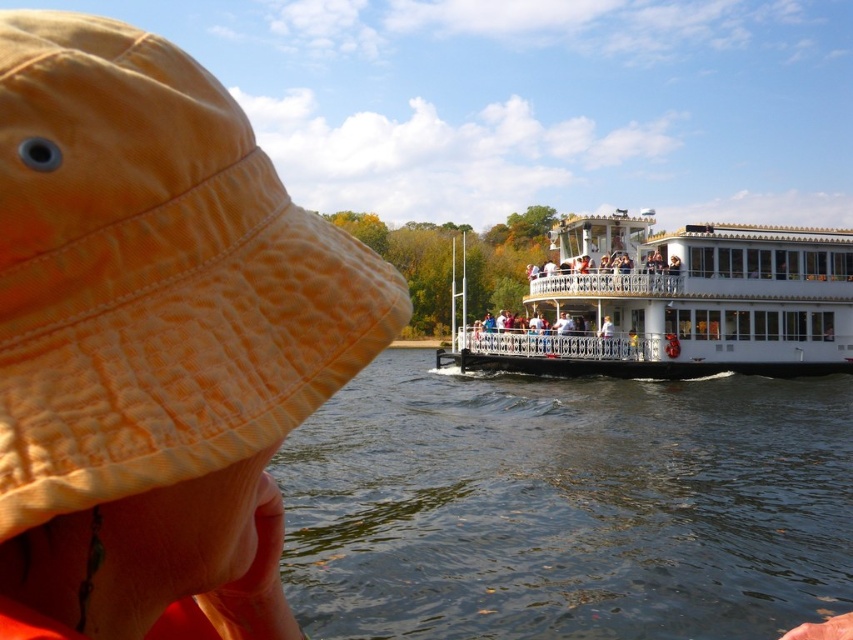
You are a photographer planning to capture the entire white glossy boat at center and dark blue water at center in one frame. Based on the scene, which of the two objects takes up more space in the image?

The dark blue water at center takes up more space in the image than the white glossy boat at center, as it is described as bigger.

Consider the image. You are a photographer on a river cruise who wants to capture a photo of the orange cotton hat at left and the white glossy boat at center in the same frame. Given that your camera has a maximum focal length that can cover 40 meters between objects, will you be able to include both in the shot?

The orange cotton hat at left and the white glossy boat at center are 41.27 meters apart. Since your camera can only cover up to 40 meters, you won not be able to include both in the same frame.

You are a photographer on the river cruise boat and want to take a photo of the orange cotton hat at left and the white glossy boat at center. Since you can only focus on one object at a time, which one should you choose to ensure the other is still in the frame?

The orange cotton hat at left is to the left of the white glossy boat at center, so focusing on the boat at center would still keep the hat in the frame to its left.